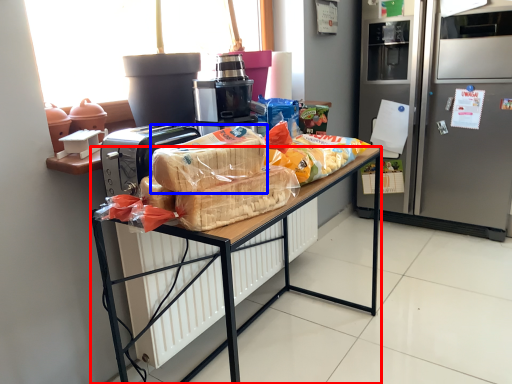
Question: Which object appears farthest to the camera in this image, desk (highlighted by a red box) or snack (highlighted by a blue box)?

Choices:
 (A) desk
 (B) snack

Answer: (A)